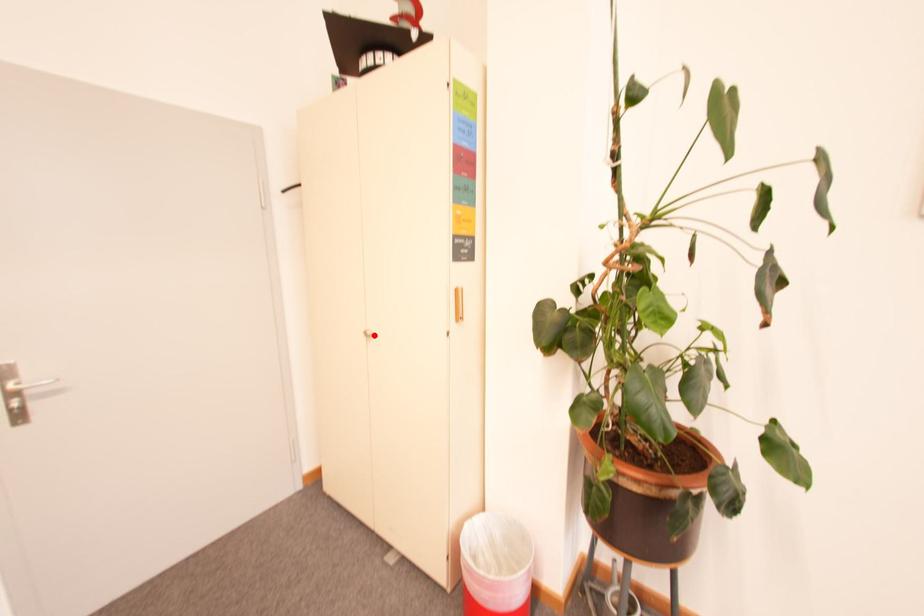
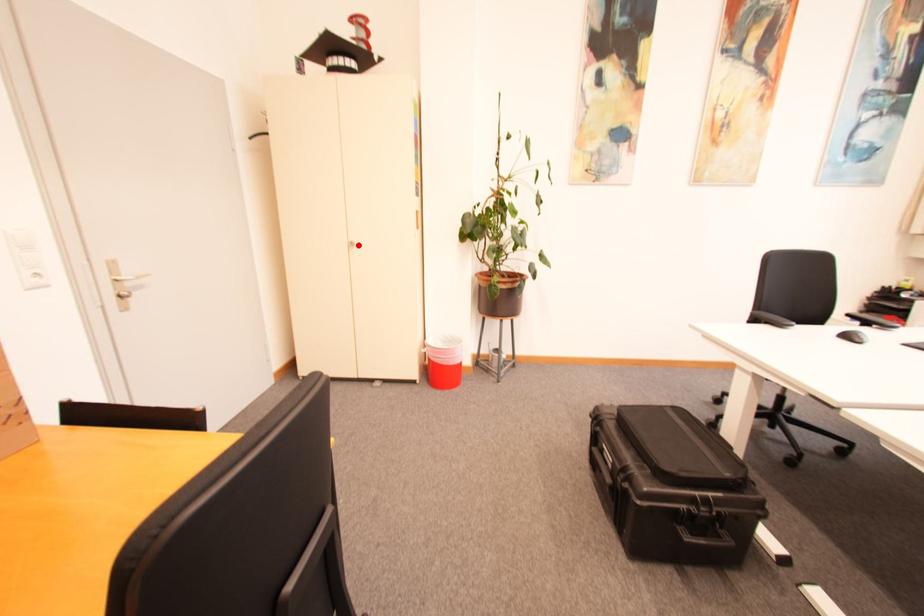
I am providing you with two images of the same scene from different viewpoints. A red point is marked on the first image and another point is marked on the second image. Are the points marked in image1 and image2 representing the same 3D position?

Yes